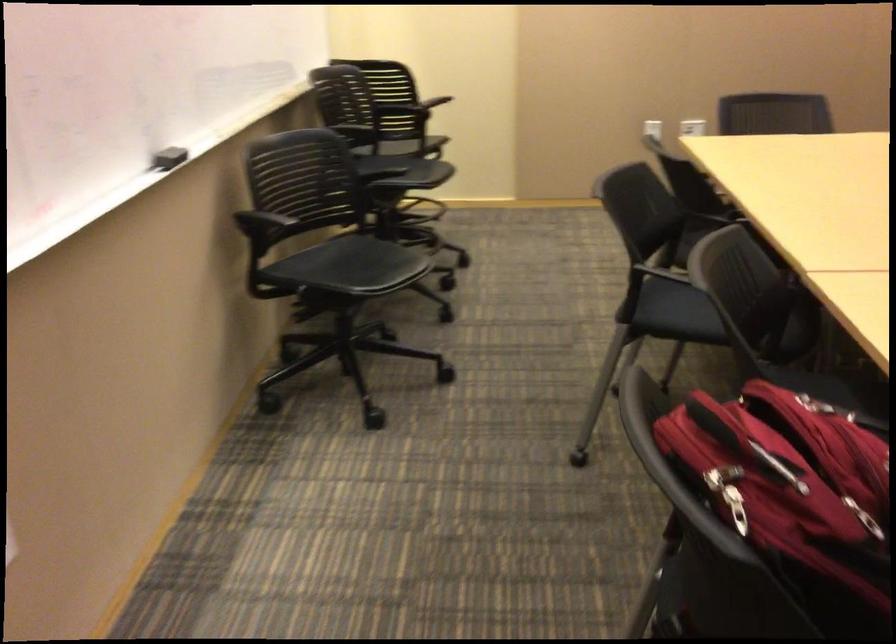
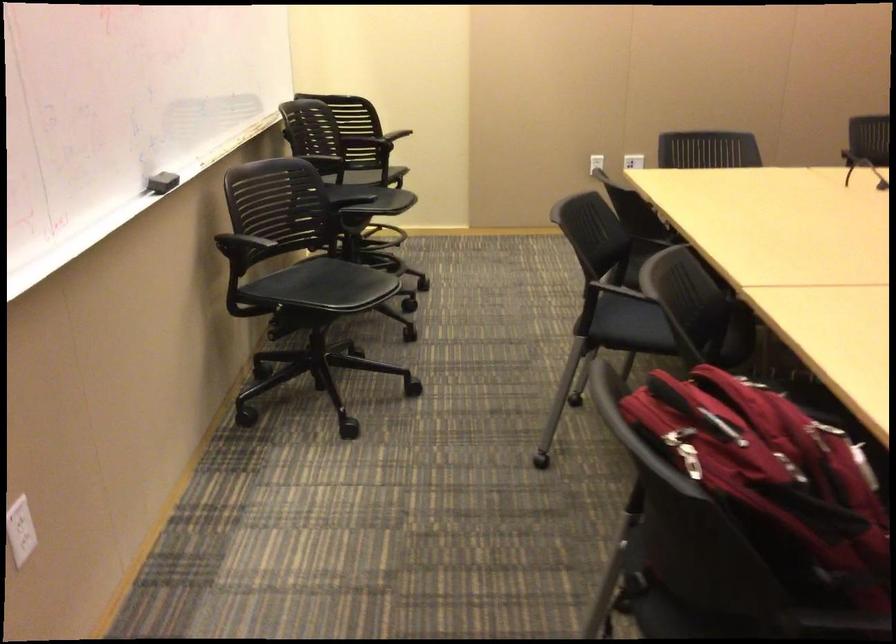
Question: The camera is either moving clockwise (left) or counter-clockwise (right) around the object. The first image is from the beginning of the video and the second image is from the end. Is the camera moving left or right when shooting the video?

Choices:
 (A) Left
 (B) Right

Answer: (A)